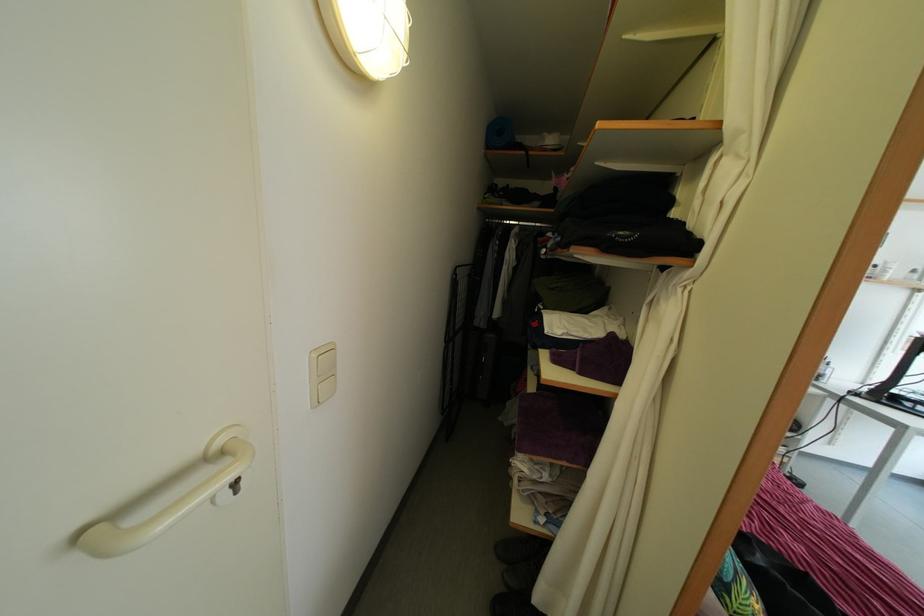
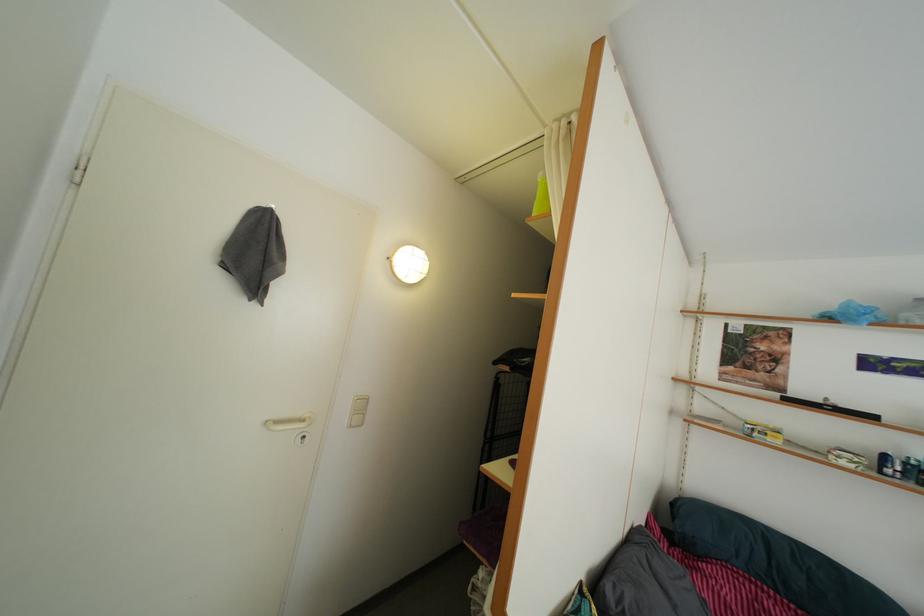
How did the camera likely rotate?

The rotation direction of the camera is left-up.